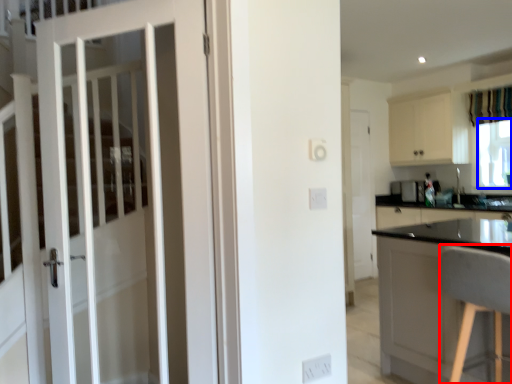
Question: Which object appears farthest to the camera in this image, chair (highlighted by a red box) or window screen (highlighted by a blue box)?

Choices:
 (A) chair
 (B) window screen

Answer: (B)